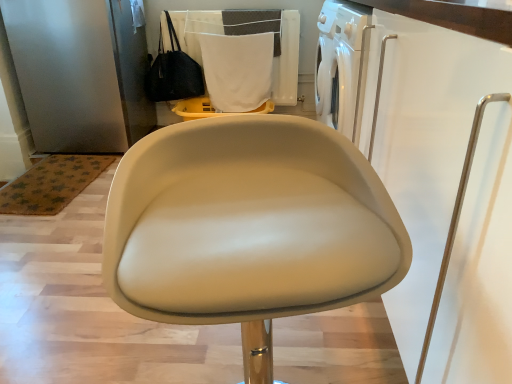
Question: Is beige leather chair at center bigger or smaller than black leather handbag at upper left?

Choices:
 (A) big
 (B) small

Answer: (A)

Question: Considering the relative positions of beige leather chair at center and black leather handbag at upper left in the image provided, is beige leather chair at center to the left or to the right of black leather handbag at upper left?

Choices:
 (A) left
 (B) right

Answer: (B)

Question: Which of these objects is positioned farthest from the beige leather chair at center?

Choices:
 (A) white fabric at upper center
 (B) white fabric laundry at upper center
 (C) black leather handbag at upper left

Answer: (B)

Question: Which object is positioned farthest from the black leather handbag at upper left?

Choices:
 (A) white fabric laundry at upper center
 (B) white fabric at upper center
 (C) beige leather chair at center

Answer: (C)